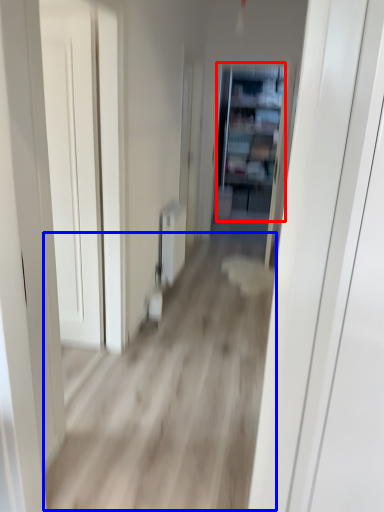
Question: Which object is closer to the camera taking this photo, bookshelf (highlighted by a red box) or corridor (highlighted by a blue box)?

Choices:
 (A) bookshelf
 (B) corridor

Answer: (B)